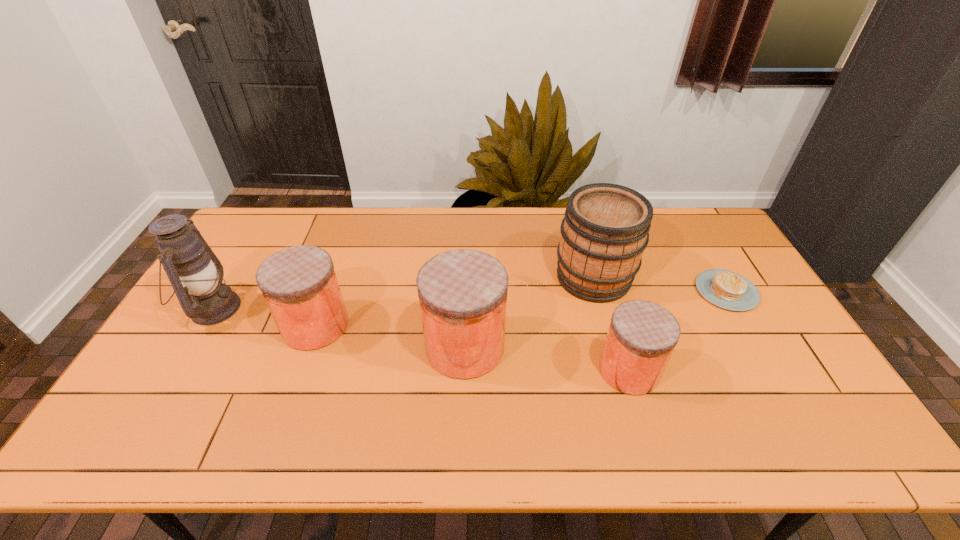
Identify the location of free spot between the rightmost object and the third shortest object. (521, 308).

In order to click on vacant space in between the cider and the oil lamp in this screenshot , I will do `click(403, 293)`.

Locate which object is the third closest to the second jar from right to left. Please provide its 2D coordinates. Your answer should be formatted as a tuple, i.e. [(x, y)], where the tuple contains the x and y coordinates of a point satisfying the conditions above.

[(642, 335)]

In order to click on object that is the closest to the leftmost object in this screenshot , I will do `click(299, 284)`.

Select which jar is the third closest to the cider. Please provide its 2D coordinates. Your answer should be formatted as a tuple, i.e. [(x, y)], where the tuple contains the x and y coordinates of a point satisfying the conditions above.

[(299, 284)]

Select which jar is the second closest to the oil lamp. Please provide its 2D coordinates. Your answer should be formatted as a tuple, i.e. [(x, y)], where the tuple contains the x and y coordinates of a point satisfying the conditions above.

[(462, 293)]

The height and width of the screenshot is (540, 960). I want to click on vacant space that satisfies the following two spatial constraints: 1. on the back side of the fourth object from right to left; 2. on the right side of the cider, so click(x=468, y=277).

Where is `vacant area in the image that satisfies the following two spatial constraints: 1. on the back side of the leftmost jar; 2. on the right side of the cider`? vacant area in the image that satisfies the following two spatial constraints: 1. on the back side of the leftmost jar; 2. on the right side of the cider is located at coordinates (333, 277).

The image size is (960, 540). I want to click on vacant space that satisfies the following two spatial constraints: 1. on the back side of the pancake; 2. on the right side of the third object from left to right, so click(467, 291).